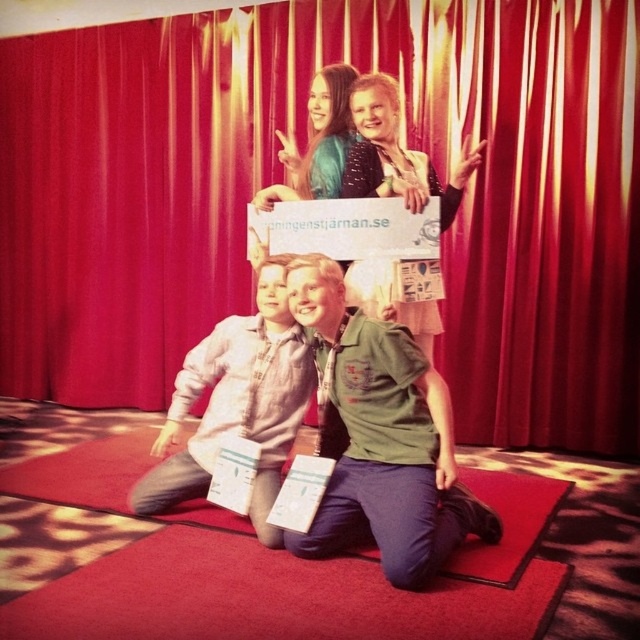
Is light gray cotton shirt at center to the right of matte black jacket at center from the viewer's perspective?

Incorrect, light gray cotton shirt at center is not on the right side of matte black jacket at center.

Who is more forward, (301,333) or (467,152)?

Positioned in front is point (301,333).

Is point (161, 512) positioned in front of point (412, 170)?

No, it is behind (412, 170).

Find the location of `light gray cotton shirt at center`. light gray cotton shirt at center is located at coordinates click(237, 403).

Can you confirm if red velvet curtain at upper center is positioned below matte black jacket at center?

No.

Between red velvet curtain at upper center and matte black jacket at center, which one appears on the right side from the viewer's perspective?

From the viewer's perspective, matte black jacket at center appears more on the right side.

In order to click on red velvet curtain at upper center in this screenshot , I will do `click(282, 179)`.

What are the coordinates of `red velvet curtain at upper center` in the screenshot? It's located at coord(282,179).

Does green uniform at center have a lesser width compared to light gray cotton shirt at center?

In fact, green uniform at center might be wider than light gray cotton shirt at center.

Between point (340, 314) and point (266, 438), which one is positioned in front?

Point (340, 314) is in front.

Is point (332, 362) positioned in front of point (300, 348)?

Yes, point (332, 362) is closer to viewer.

Locate an element on the screen. green uniform at center is located at coordinates (380, 438).